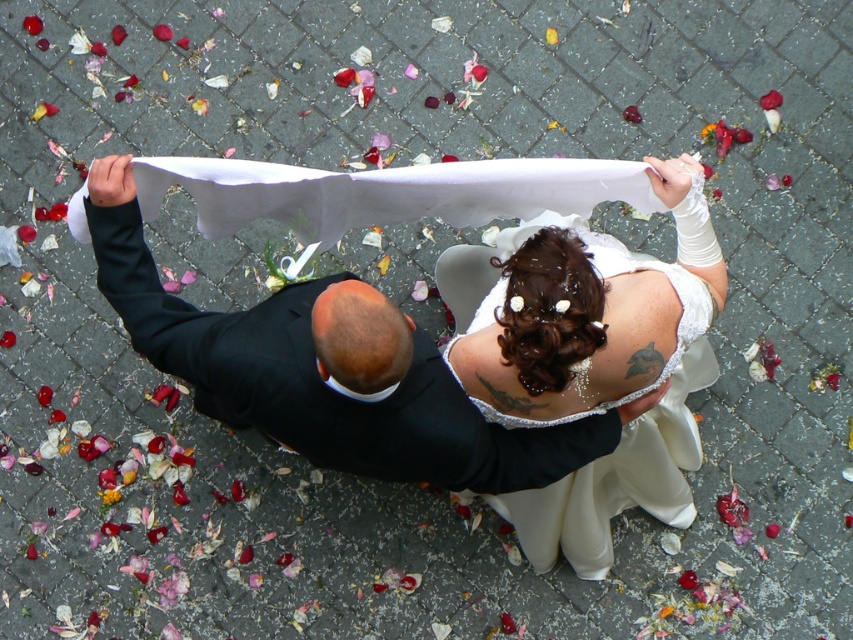
Based on the scene description, what are the coordinates of the white lace dress at center?

The white lace dress at center is located at coordinates point (590, 360).